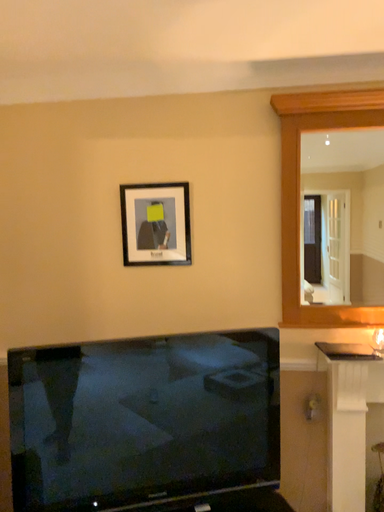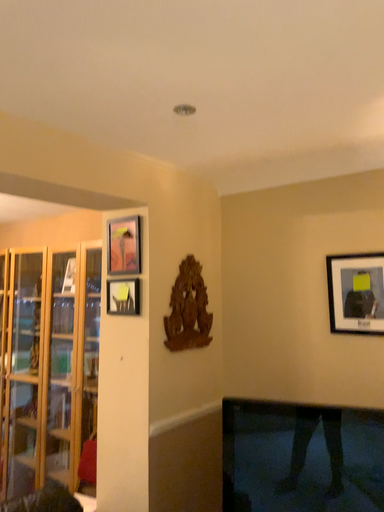
Question: How did the camera likely rotate when shooting the video?

Choices:
 (A) rotated downward
 (B) rotated upward

Answer: (B)